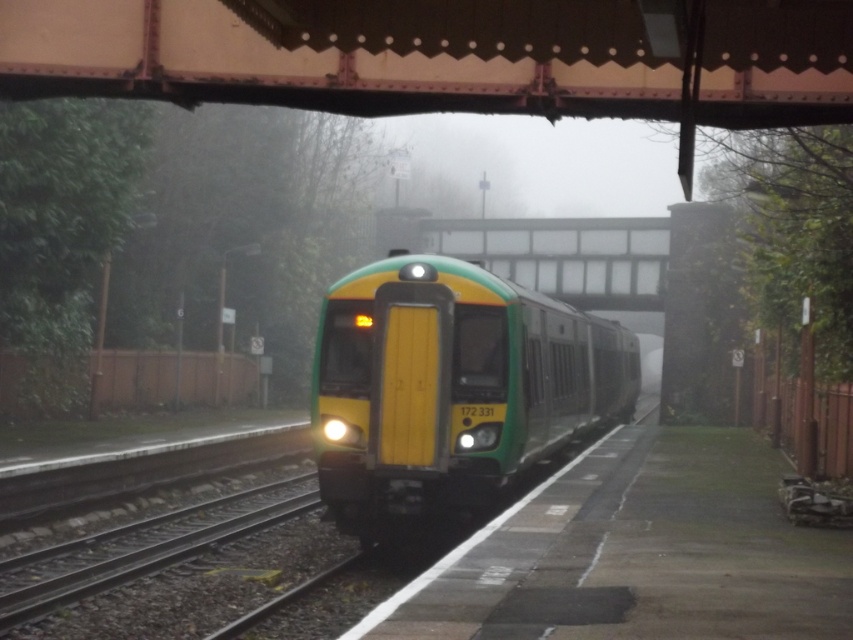
Consider the image. You are a passenger waiting on the platform and want to know if the metallic brown bridge at upper center is larger than the green matte train at center. Based on the scene, what can you observe?

The metallic brown bridge at upper center is smaller than the green matte train at center, so the train is larger.

You are a passenger waiting on the platform and want to cross to the other side of the tracks. You see the metallic brown bridge at upper center and the green matte train at center. Which structure should you use to safely cross over the tracks?

You should use the metallic brown bridge at upper center to safely cross over the tracks because it is located above the green matte train at center, providing a safe passage over the tracks without interfering with the train.

You are standing at the platform edge marked by the white line. You see a point labeled as point (445,54) in the image. What object does this point correspond to?

The point (445,54) corresponds to the metallic brown bridge at upper center.